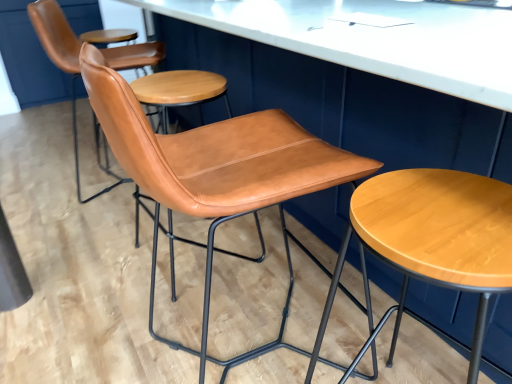
Identify the location of free space in front of cognac leather chair at center, the second chair viewed from the front. Image resolution: width=512 pixels, height=384 pixels. (138, 318).